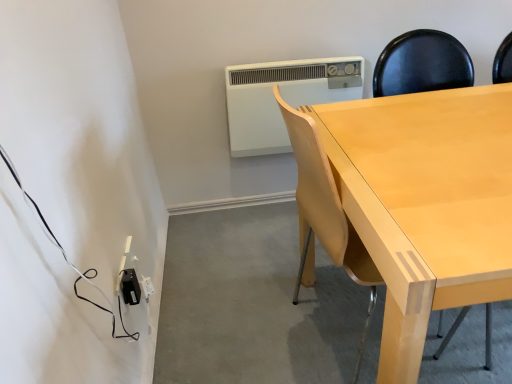
Question: From a real-world perspective, is white plastic air conditioning unit at upper center physically above black plastic power adapter at lower left?

Choices:
 (A) no
 (B) yes

Answer: (B)

Question: From the image's perspective, would you say white plastic air conditioning unit at upper center is shown under black plastic power adapter at lower left?

Choices:
 (A) no
 (B) yes

Answer: (A)

Question: Is white plastic air conditioning unit at upper center taller than black plastic power adapter at lower left?

Choices:
 (A) no
 (B) yes

Answer: (B)

Question: Can you confirm if white plastic air conditioning unit at upper center is positioned to the right of black plastic power adapter at lower left?

Choices:
 (A) no
 (B) yes

Answer: (B)

Question: Is white plastic air conditioning unit at upper center at the left side of black plastic power adapter at lower left?

Choices:
 (A) no
 (B) yes

Answer: (A)

Question: From the image's perspective, is white plastic air conditioning unit at upper center above or below black plastic power adapter at lower left?

Choices:
 (A) below
 (B) above

Answer: (B)

Question: Based on their sizes in the image, would you say white plastic air conditioning unit at upper center is bigger or smaller than black plastic power adapter at lower left?

Choices:
 (A) big
 (B) small

Answer: (A)

Question: Is point (349, 91) positioned closer to the camera than point (134, 292)?

Choices:
 (A) farther
 (B) closer

Answer: (A)

Question: Considering the relative positions of white plastic air conditioning unit at upper center and black plastic power adapter at lower left in the image provided, is white plastic air conditioning unit at upper center to the left or to the right of black plastic power adapter at lower left?

Choices:
 (A) right
 (B) left

Answer: (A)

Question: From the image's perspective, is black plastic power adapter at lower left located above or below light wood chair at center?

Choices:
 (A) above
 (B) below

Answer: (B)

Question: From a real-world perspective, is black plastic power adapter at lower left positioned above or below light wood chair at center?

Choices:
 (A) below
 (B) above

Answer: (A)

Question: Looking at their shapes, would you say black plastic power adapter at lower left is wider or thinner than light wood chair at center?

Choices:
 (A) wide
 (B) thin

Answer: (B)

Question: Based on their sizes in the image, would you say black plastic power adapter at lower left is bigger or smaller than light wood chair at center?

Choices:
 (A) small
 (B) big

Answer: (A)

Question: From a real-world perspective, relative to black plastic power adapter at lower left, is light wood chair at center vertically above or below?

Choices:
 (A) above
 (B) below

Answer: (A)

Question: In terms of size, does light wood chair at center appear bigger or smaller than black plastic power adapter at lower left?

Choices:
 (A) small
 (B) big

Answer: (B)